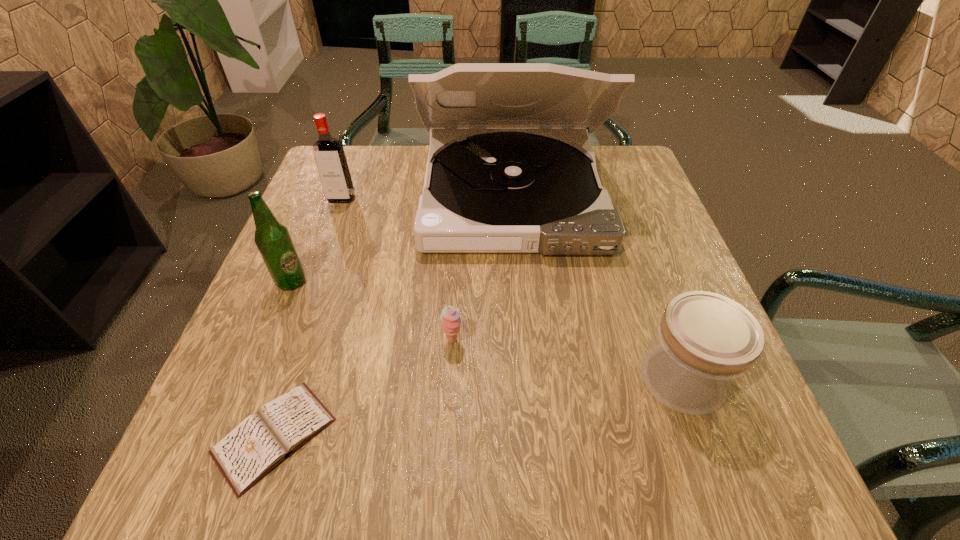
Find the location of a particular element. the tallest object is located at coordinates (502, 177).

Identify the location of vodka. (332, 165).

The width and height of the screenshot is (960, 540). What are the coordinates of `the third farthest object` in the screenshot? It's located at (273, 240).

You are a GUI agent. You are given a task and a screenshot of the screen. Output one action in this format:
    pyautogui.click(x=<x>, y=<y>)
    Task: Click on the jar
    
    Given the screenshot: What is the action you would take?
    pyautogui.click(x=705, y=343)

Find the location of `sherbert`. sherbert is located at coordinates (450, 318).

At what (x,y) coordinates should I click in order to perform the action: click on diary. Please return your answer as a coordinate pair (x, y). This screenshot has width=960, height=540. Looking at the image, I should click on coord(260,442).

In order to click on vacant space positioned on the control panel of the tallest object in this screenshot , I will do `click(527, 367)`.

Image resolution: width=960 pixels, height=540 pixels. Find the location of `free space located 0.270m on the front and back of the vodka`. free space located 0.270m on the front and back of the vodka is located at coordinates (310, 284).

The image size is (960, 540). What are the coordinates of `vacant space situated on the label of the third farthest object` in the screenshot? It's located at (403, 282).

Identify the location of free space located 0.080m on the back of the fourth tallest object. Image resolution: width=960 pixels, height=540 pixels. (658, 311).